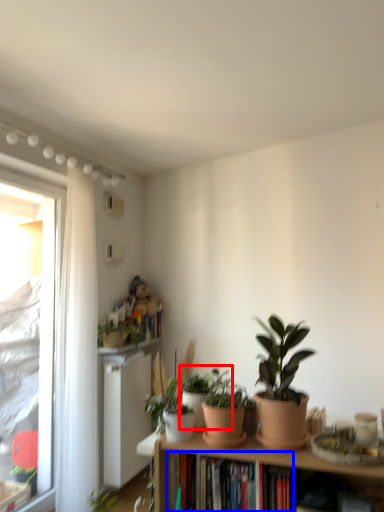
Question: Which object appears farthest to the camera in this image, houseplant (highlighted by a red box) or book (highlighted by a blue box)?

Choices:
 (A) houseplant
 (B) book

Answer: (A)